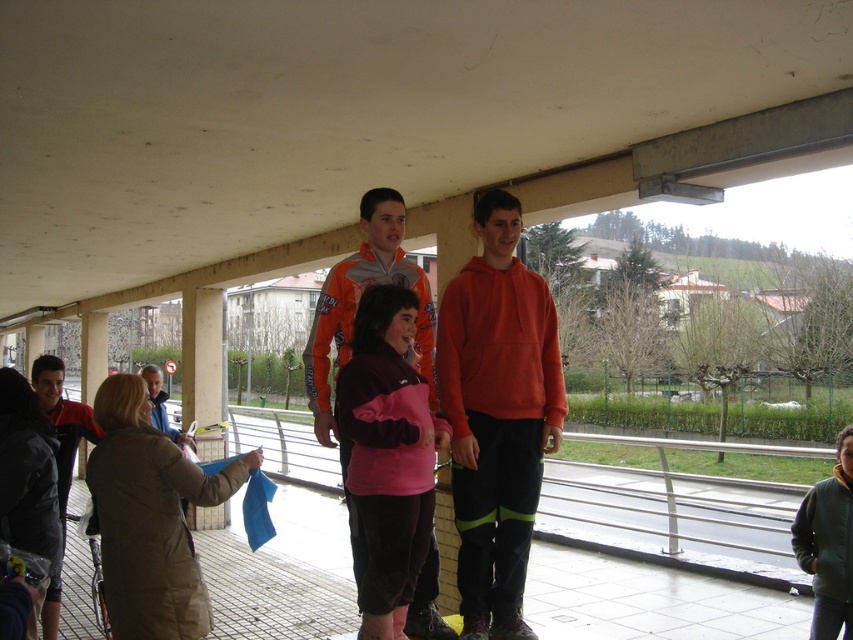
Does orange fleece at center have a greater width compared to pink fleece jacket at center?

Indeed, orange fleece at center has a greater width compared to pink fleece jacket at center.

Who is shorter, orange fleece at center or pink fleece jacket at center?

pink fleece jacket at center is shorter.

Between point (506, 492) and point (415, 508), which one is positioned in front?

Positioned in front is point (415, 508).

Identify the location of orange fleece at center. The width and height of the screenshot is (853, 640). pos(497,413).

Between point (517, 484) and point (149, 381), which one is positioned in front?

Point (517, 484) is in front.

Between orange fleece at center and orange jacket at center, which one is positioned lower?

orange jacket at center

Who is more forward, (546, 358) or (149, 400)?

Positioned in front is point (546, 358).

The height and width of the screenshot is (640, 853). In order to click on orange fleece at center in this screenshot , I will do `click(497, 413)`.

Who is more distant from viewer, (x=393, y=401) or (x=148, y=380)?

The point (x=148, y=380) is more distant.

Does pink fleece jacket at center have a smaller size compared to orange jacket at center?

Yes, pink fleece jacket at center is smaller than orange jacket at center.

Where is `pink fleece jacket at center`? The width and height of the screenshot is (853, 640). pink fleece jacket at center is located at coordinates (387, 458).